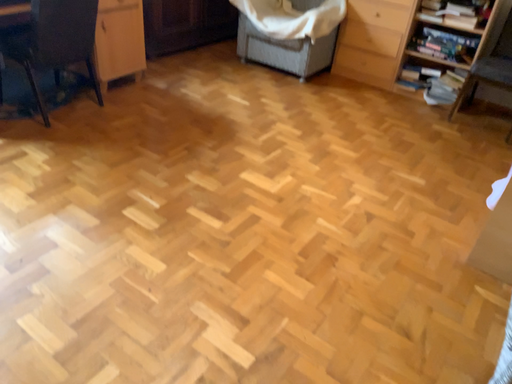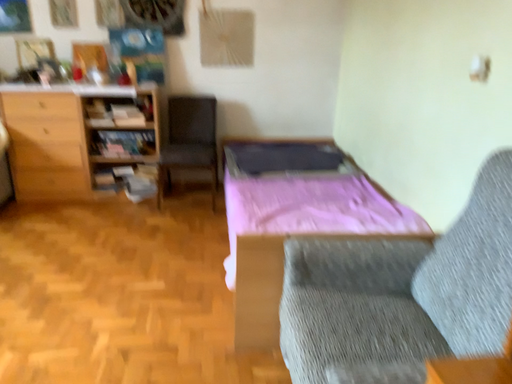
Question: Which way did the camera rotate in the video?

Choices:
 (A) rotated left
 (B) rotated right

Answer: (B)